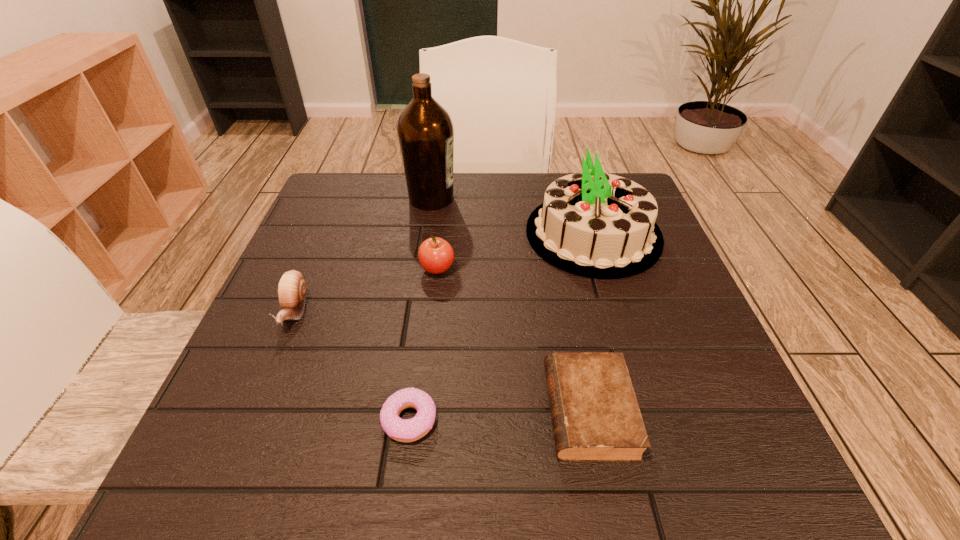
You are a GUI agent. You are given a task and a screenshot of the screen. Output one action in this format:
    pyautogui.click(x=<x>, y=<y>)
    Task: Click on the free spot located on the front-facing side of the leftmost object
    This screenshot has height=540, width=960.
    Given the screenshot: What is the action you would take?
    [264, 384]

I want to click on vacant space positioned 0.170m on the spine side of the second shortest object, so click(x=437, y=411).

Find the location of a particular element. free region located 0.100m on the spine side of the second shortest object is located at coordinates (483, 411).

The height and width of the screenshot is (540, 960). Find the location of `free space located on the spine side of the second shortest object`. free space located on the spine side of the second shortest object is located at coordinates [377, 411].

Find the location of `vacant space located 0.180m on the right of the doughnut`. vacant space located 0.180m on the right of the doughnut is located at coordinates (x=557, y=419).

The width and height of the screenshot is (960, 540). I want to click on olive oil at the far edge, so click(425, 130).

You are a GUI agent. You are given a task and a screenshot of the screen. Output one action in this format:
    pyautogui.click(x=<x>, y=<y>)
    Task: Click on the birthday cake located in the far edge section of the desktop
    
    Given the screenshot: What is the action you would take?
    pyautogui.click(x=596, y=225)

Locate an element on the screen. The width and height of the screenshot is (960, 540). diary that is at the near edge is located at coordinates (595, 416).

At what (x,y) coordinates should I click in order to perform the action: click on doughnut that is at the near edge. Please return your answer as a coordinate pair (x, y). The height and width of the screenshot is (540, 960). Looking at the image, I should click on (403, 430).

I want to click on object that is at the left edge, so click(292, 287).